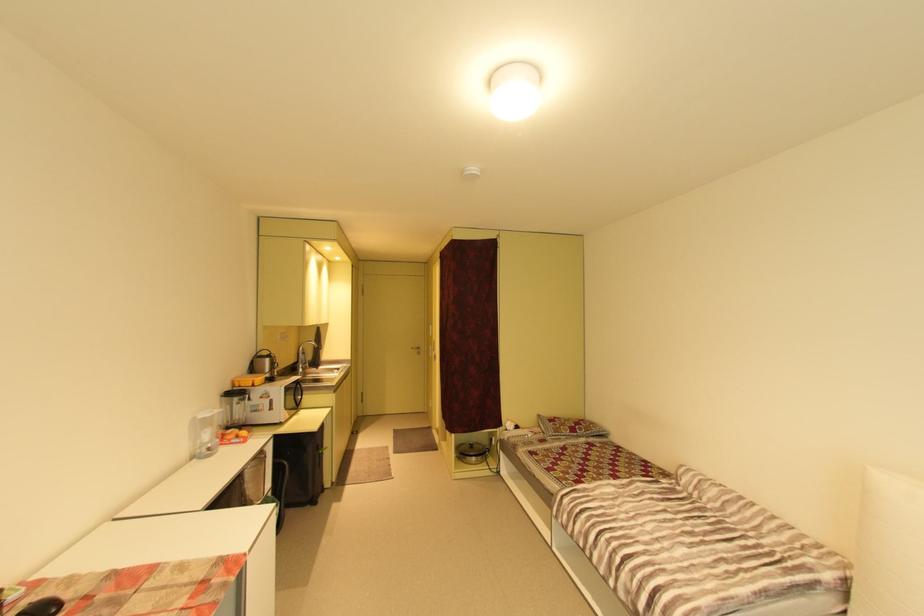
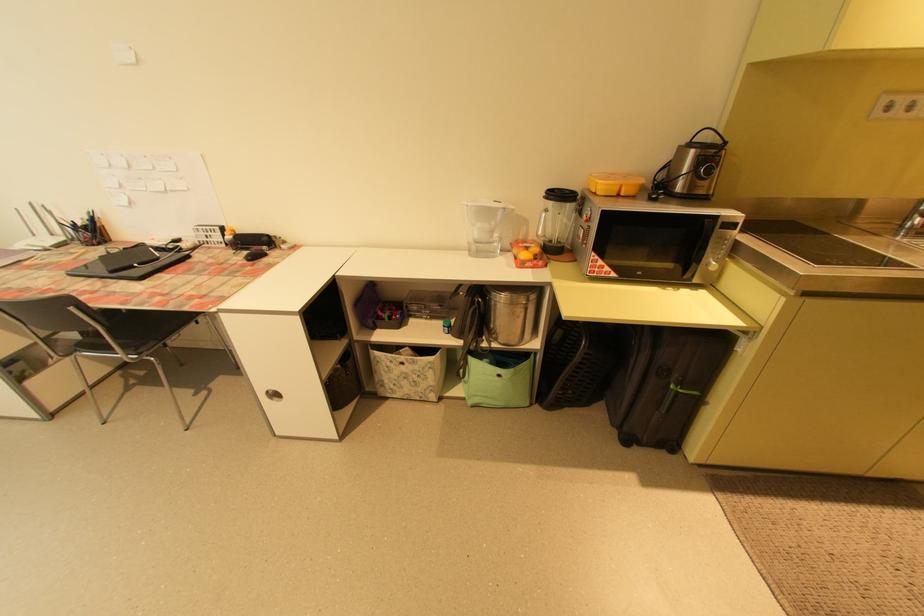
Where in the second image is the point corresponding to [228,411] from the first image?

(511, 209)